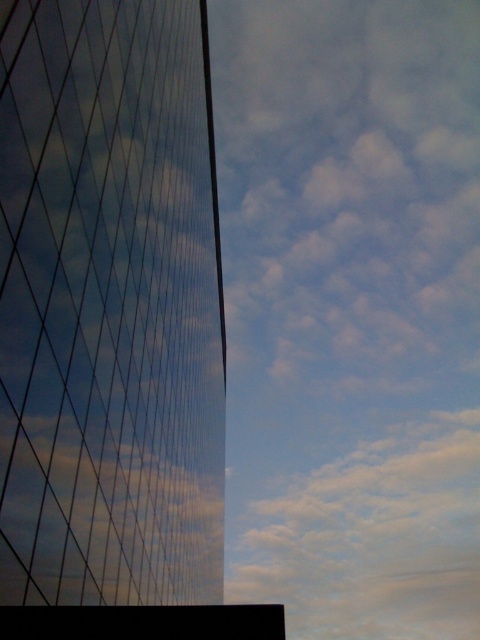
Who is more forward, (x=37, y=332) or (x=423, y=490)?

Positioned in front is point (x=37, y=332).

Does reflective glass building at left appear over white fluffy cloud at upper center?

Indeed, reflective glass building at left is positioned over white fluffy cloud at upper center.

You are a GUI agent. You are given a task and a screenshot of the screen. Output one action in this format:
    pyautogui.click(x=<x>, y=<y>)
    Task: Click on the reflective glass building at left
    The height and width of the screenshot is (640, 480).
    Given the screenshot: What is the action you would take?
    pyautogui.click(x=108, y=305)

This screenshot has height=640, width=480. I want to click on reflective glass building at left, so click(x=108, y=305).